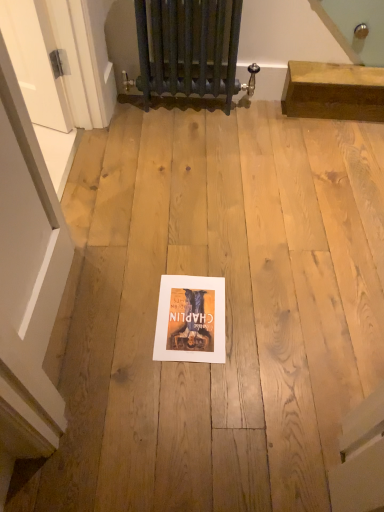
Image resolution: width=384 pixels, height=512 pixels. Find the location of `vacant space in matte paper postcard at center (from a real-world perspective)`. vacant space in matte paper postcard at center (from a real-world perspective) is located at coordinates (188, 310).